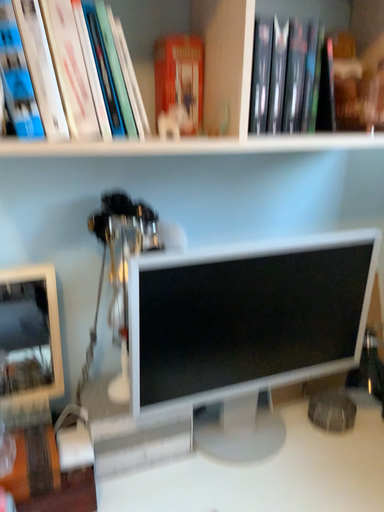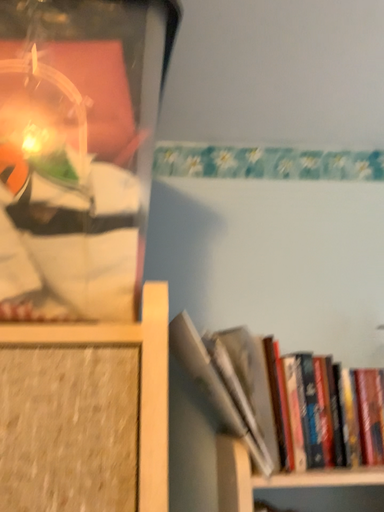
Question: How did the camera likely rotate when shooting the video?

Choices:
 (A) rotated left
 (B) rotated right

Answer: (A)